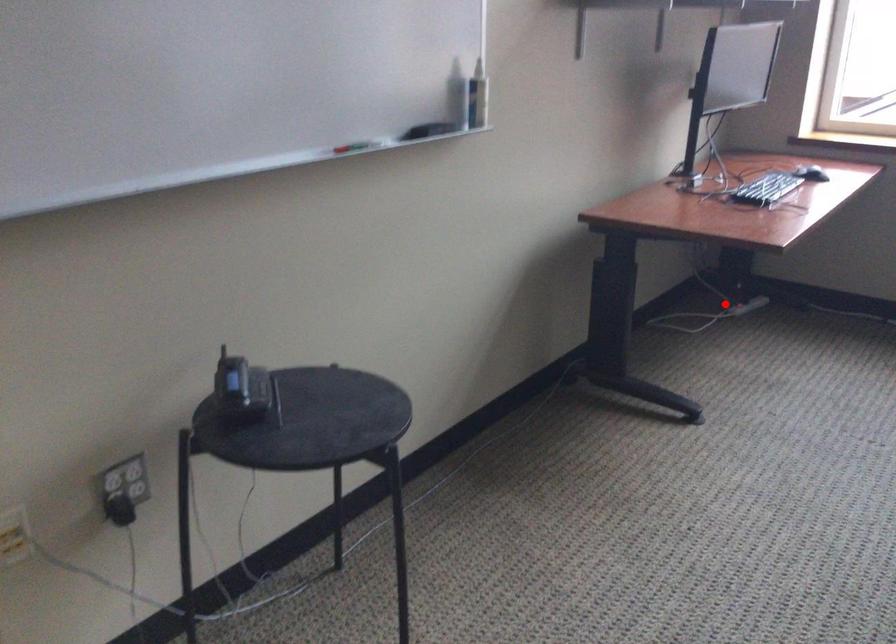
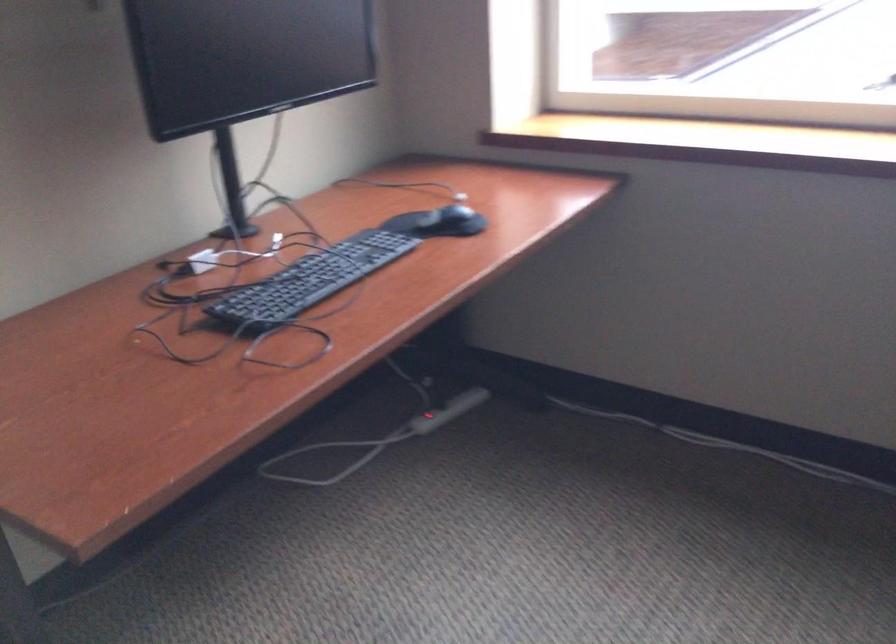
Locate, in the second image, the point that corresponds to the highlighted location in the first image.

(378, 439)